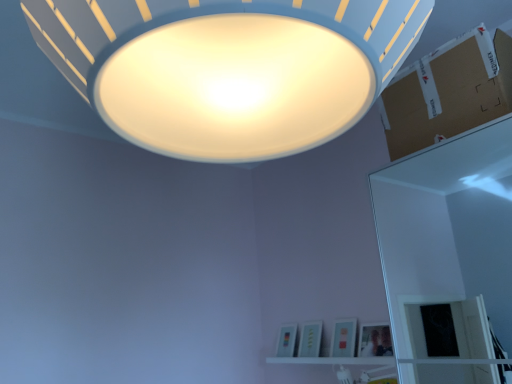
Question: Is brown cardboard at upper right further to the viewer compared to white glossy shelf at lower center?

Choices:
 (A) no
 (B) yes

Answer: (A)

Question: From the image's perspective, does brown cardboard at upper right appear lower than white glossy shelf at lower center?

Choices:
 (A) yes
 (B) no

Answer: (B)

Question: Is white glossy shelf at lower center a part of brown cardboard at upper right?

Choices:
 (A) yes
 (B) no

Answer: (B)

Question: Is brown cardboard at upper right positioned before white glossy shelf at lower center?

Choices:
 (A) no
 (B) yes

Answer: (B)

Question: Is brown cardboard at upper right bigger than white glossy shelf at lower center?

Choices:
 (A) yes
 (B) no

Answer: (A)

Question: From the image's perspective, is white glossy shelf at lower center above or below brown cardboard at upper right?

Choices:
 (A) below
 (B) above

Answer: (A)

Question: Does point (298, 359) appear closer or farther from the camera than point (424, 140)?

Choices:
 (A) closer
 (B) farther

Answer: (B)

Question: Is white glossy shelf at lower center inside the boundaries of brown cardboard at upper right, or outside?

Choices:
 (A) inside
 (B) outside

Answer: (B)

Question: From a real-world perspective, is white glossy shelf at lower center above or below brown cardboard at upper right?

Choices:
 (A) below
 (B) above

Answer: (A)

Question: Is white matte lampshade at upper center situated inside brown cardboard at upper right or outside?

Choices:
 (A) inside
 (B) outside

Answer: (B)

Question: Does point (224, 6) appear closer or farther from the camera than point (504, 52)?

Choices:
 (A) farther
 (B) closer

Answer: (B)

Question: From the image's perspective, relative to brown cardboard at upper right, is white matte lampshade at upper center above or below?

Choices:
 (A) below
 (B) above

Answer: (B)

Question: In the image, is white matte lampshade at upper center positioned in front of or behind brown cardboard at upper right?

Choices:
 (A) behind
 (B) front

Answer: (B)

Question: Is brown cardboard at upper right in front of or behind white matte lampshade at upper center in the image?

Choices:
 (A) front
 (B) behind

Answer: (B)

Question: Considering the positions of brown cardboard at upper right and white matte lampshade at upper center in the image, is brown cardboard at upper right bigger or smaller than white matte lampshade at upper center?

Choices:
 (A) small
 (B) big

Answer: (A)